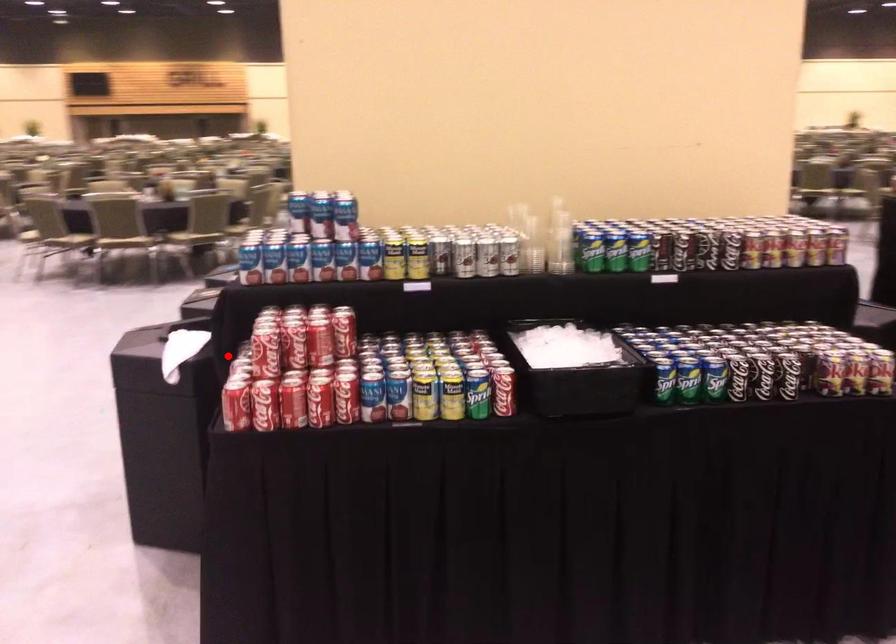
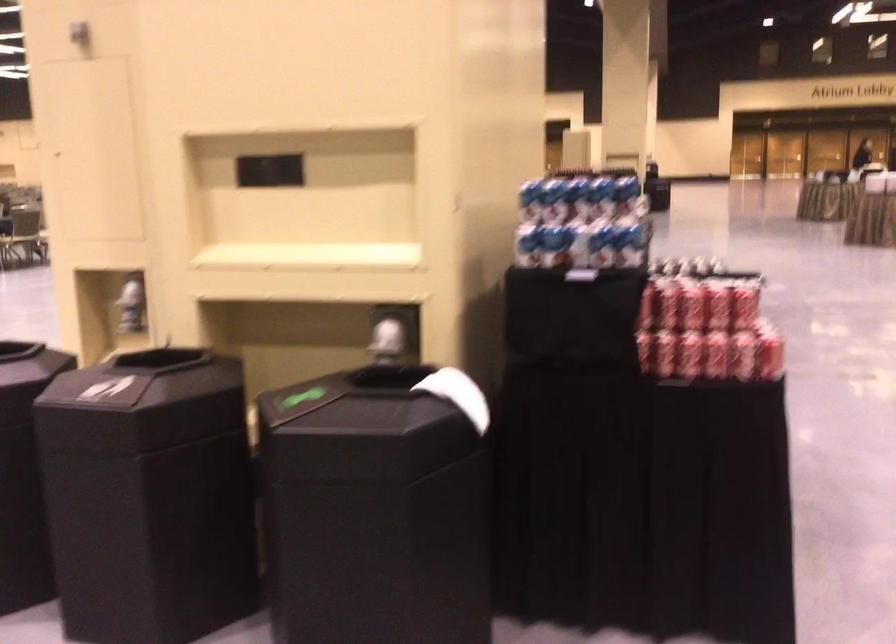
Find the pixel in the second image that matches the highlighted location in the first image.

(645, 351)